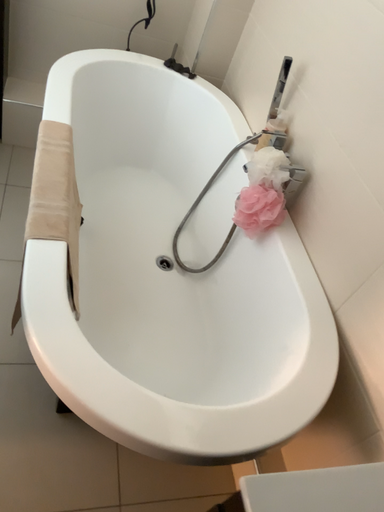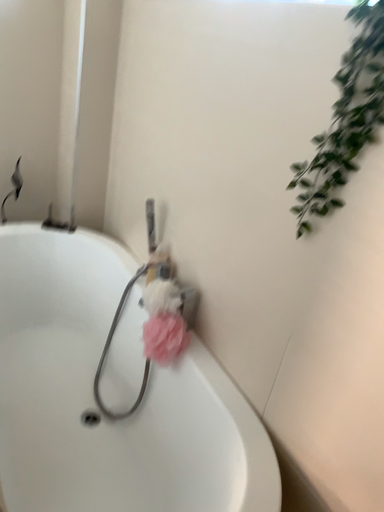
Question: Which way did the camera rotate in the video?

Choices:
 (A) rotated left
 (B) rotated right

Answer: (B)